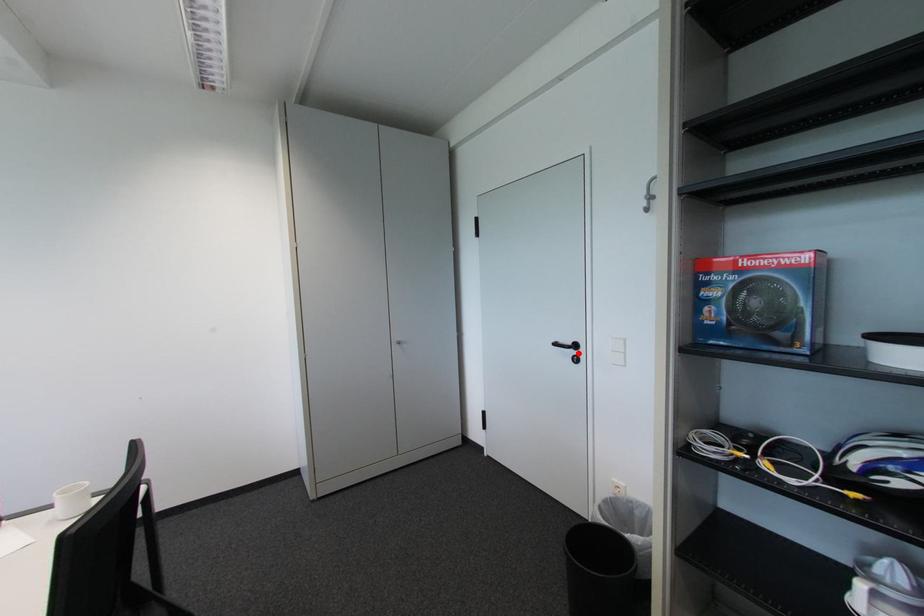
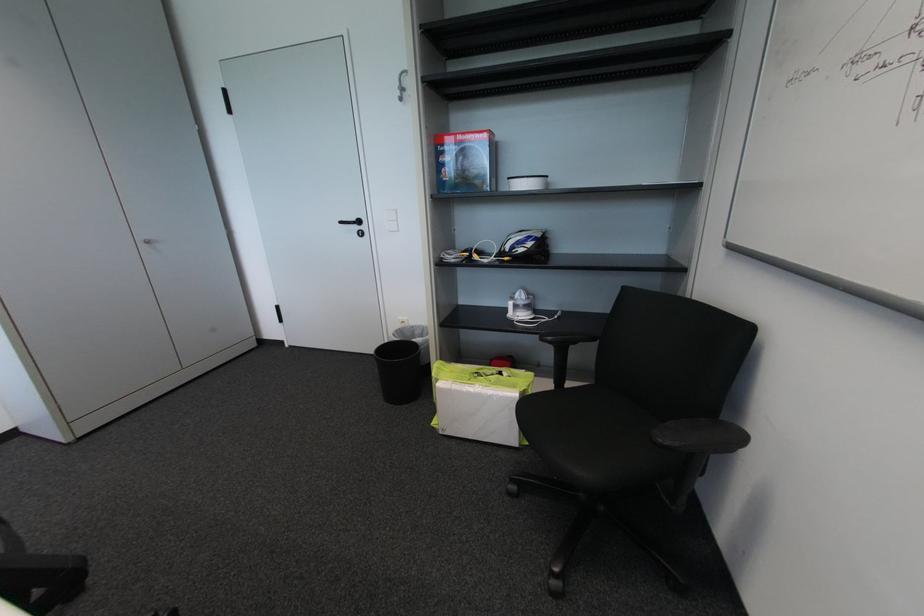
Locate, in the second image, the point that corresponds to the highlighted location in the first image.

(362, 229)